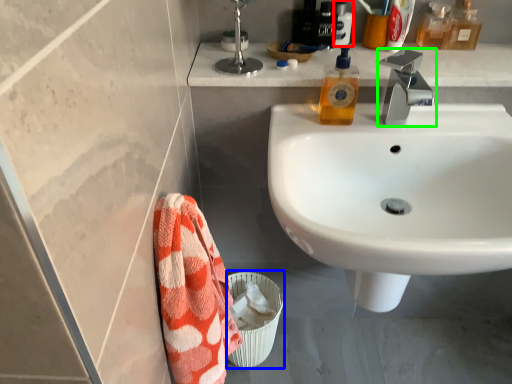
Question: Based on their relative distances, which object is farther from toiletry (highlighted by a red box)? Choose from toilet bowl (highlighted by a blue box) and tap (highlighted by a green box).

Choices:
 (A) toilet bowl
 (B) tap

Answer: (A)